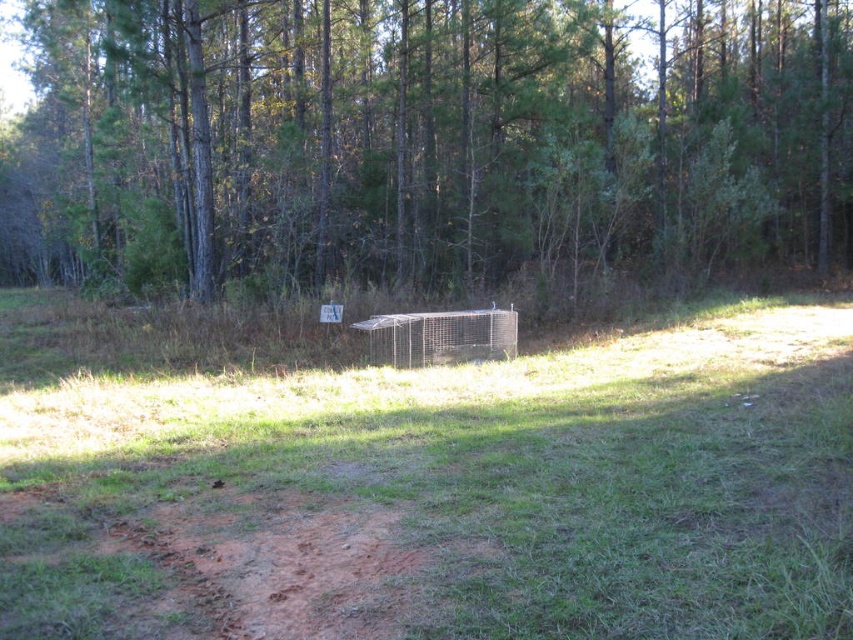
Can you confirm if green grass at center is taller than brown wood tree at center?

Incorrect, green grass at center's height is not larger of brown wood tree at center's.

Which is in front, point (541, 384) or point (239, 3)?

Point (541, 384) is more forward.

You are a GUI agent. You are given a task and a screenshot of the screen. Output one action in this format:
    pyautogui.click(x=<x>, y=<y>)
    Task: Click on the green grass at center
    
    Given the screenshot: What is the action you would take?
    pyautogui.click(x=438, y=492)